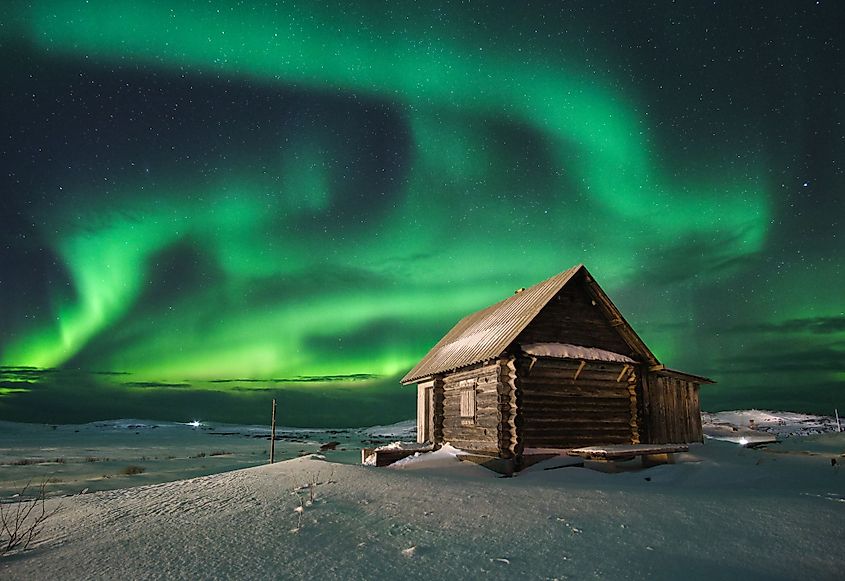
Where is `wooden window shutters`? wooden window shutters is located at coordinates (462, 396).